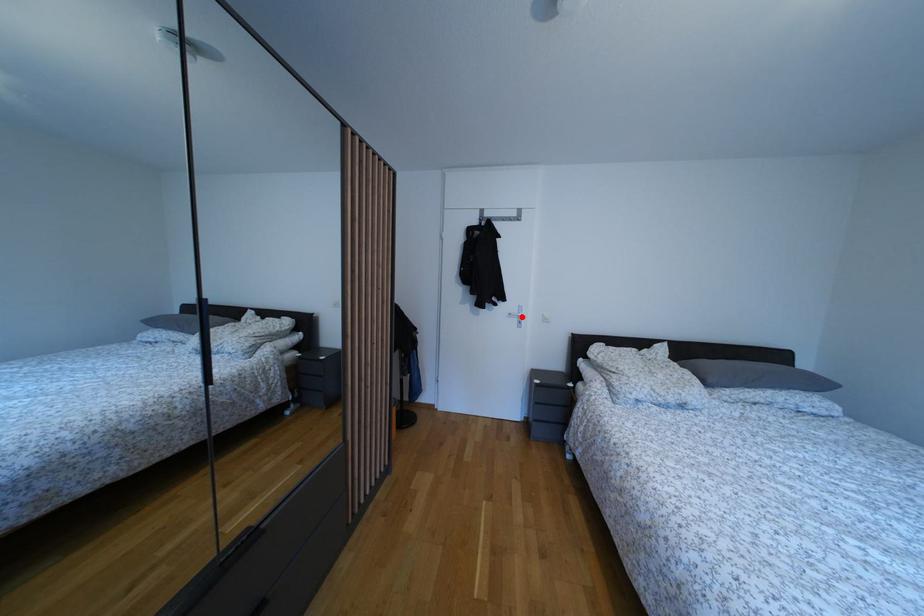
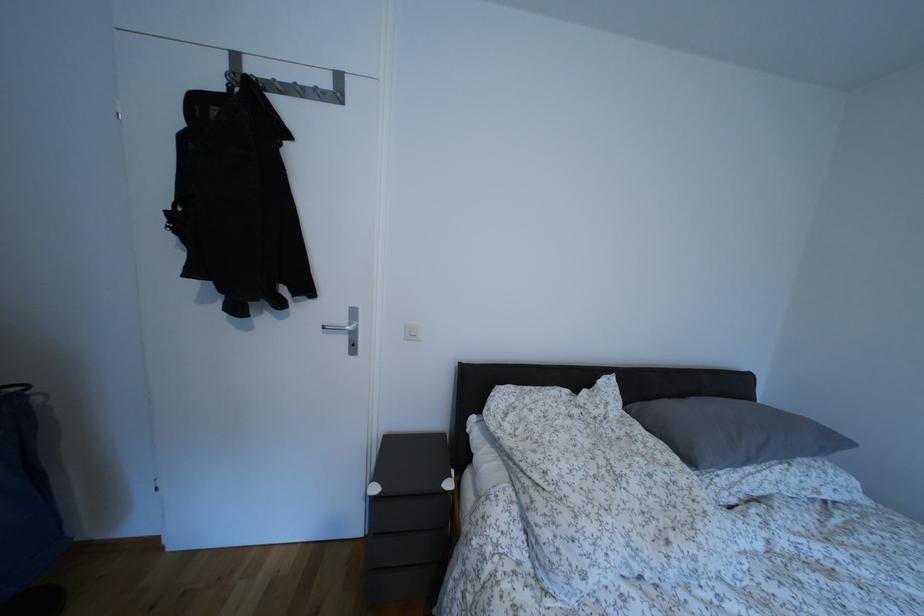
In the second image, find the point that corresponds to the highlighted location in the first image.

(348, 325)